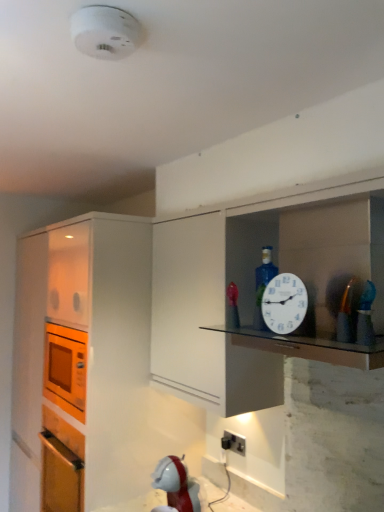
Question: Is white plastic smoke detector at upper center next to black plastic electric outlet at lower center and touching it?

Choices:
 (A) yes
 (B) no

Answer: (B)

Question: Is white plastic smoke detector at upper center taller than black plastic electric outlet at lower center?

Choices:
 (A) yes
 (B) no

Answer: (B)

Question: From a real-world perspective, is white plastic smoke detector at upper center below black plastic electric outlet at lower center?

Choices:
 (A) yes
 (B) no

Answer: (B)

Question: Does white plastic smoke detector at upper center lie in front of black plastic electric outlet at lower center?

Choices:
 (A) no
 (B) yes

Answer: (B)

Question: Is white plastic smoke detector at upper center at the right side of black plastic electric outlet at lower center?

Choices:
 (A) no
 (B) yes

Answer: (A)

Question: Can you confirm if white plastic smoke detector at upper center is wider than black plastic electric outlet at lower center?

Choices:
 (A) no
 (B) yes

Answer: (B)

Question: From a real-world perspective, is white plastic clock at upper right physically below transparent glass shelf at upper center?

Choices:
 (A) no
 (B) yes

Answer: (A)

Question: From the image's perspective, does white plastic clock at upper right appear higher than transparent glass shelf at upper center?

Choices:
 (A) yes
 (B) no

Answer: (A)

Question: Is white plastic clock at upper right not within transparent glass shelf at upper center?

Choices:
 (A) yes
 (B) no

Answer: (A)

Question: Is white plastic clock at upper right shorter than transparent glass shelf at upper center?

Choices:
 (A) no
 (B) yes

Answer: (A)

Question: Is white plastic clock at upper right to the left of transparent glass shelf at upper center from the viewer's perspective?

Choices:
 (A) no
 (B) yes

Answer: (B)

Question: Is the position of white plastic clock at upper right less distant than that of transparent glass shelf at upper center?

Choices:
 (A) no
 (B) yes

Answer: (A)

Question: From the image's perspective, is metallic gold toy at right over white plastic clock at upper right?

Choices:
 (A) yes
 (B) no

Answer: (A)